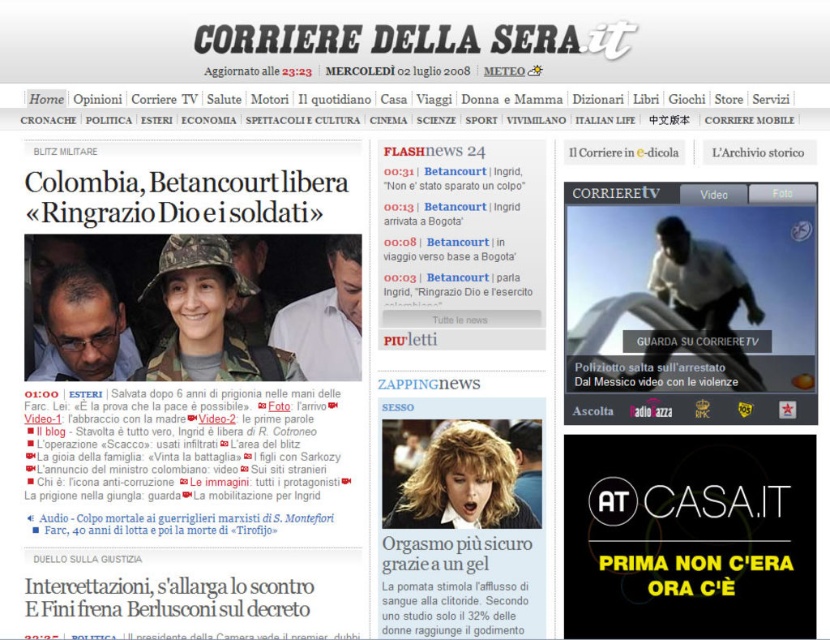
Question: Among these objects, which one is farthest from the camera?

Choices:
 (A) camouflage fabric hat at center
 (B) matte white shirt at center
 (C) blurred plastic video player at right
 (D) dark brown hair at left

Answer: (B)

Question: Does dark skin/rough fabric person at right have a lesser width compared to dark brown hair at left?

Choices:
 (A) yes
 (B) no

Answer: (B)

Question: Is blonde hair at center further to camera compared to camouflage fabric soldier at center?

Choices:
 (A) no
 (B) yes

Answer: (A)

Question: Can you confirm if camouflage fabric hat at center is positioned below matte white shirt at center?

Choices:
 (A) yes
 (B) no

Answer: (A)

Question: Estimate the real-world distances between objects in this image. Which object is farther from the blurred plastic video player at right?

Choices:
 (A) camouflage fabric soldier at center
 (B) camouflage fabric hat at center
 (C) blonde hair at center
 (D) dark skin/rough fabric person at right

Answer: (B)

Question: Which object is the farthest from the camouflage fabric hat at center?

Choices:
 (A) dark skin/rough fabric person at right
 (B) dark brown hair at left
 (C) camouflage fabric soldier at center
 (D) matte white shirt at center

Answer: (A)